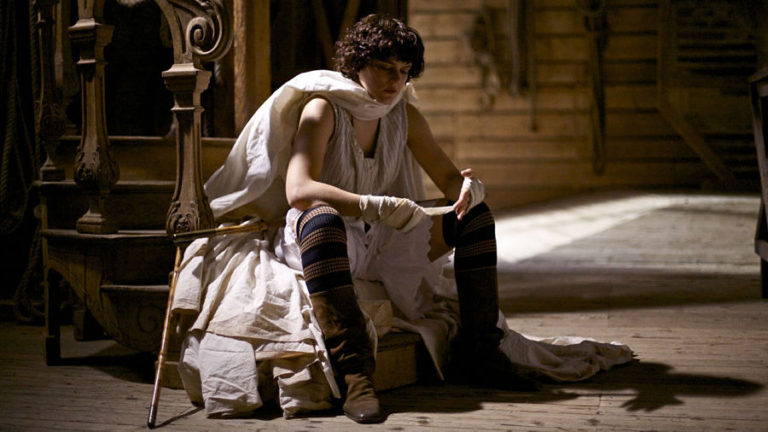
Where is `wall of room`? The height and width of the screenshot is (432, 768). wall of room is located at coordinates (515, 141).